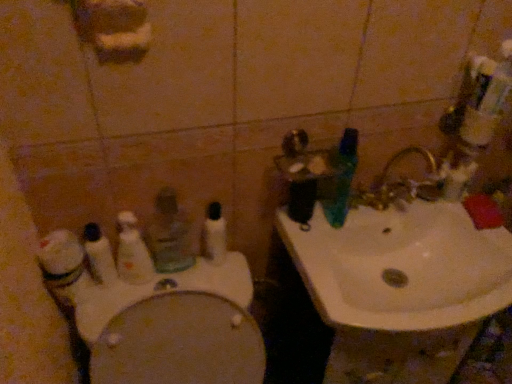
Question: Can you confirm if white plastic toothbrush at left, which appears as the fourth toothbrush when viewed from the right, is bigger than white glossy toilet at lower left?

Choices:
 (A) yes
 (B) no

Answer: (B)

Question: Is the position of white plastic toothbrush at left, which is the first toothbrush in left-to-right order, more distant than that of white glossy toilet at lower left?

Choices:
 (A) yes
 (B) no

Answer: (A)

Question: From a real-world perspective, is white plastic toothbrush at left, which appears as the fourth toothbrush when viewed from the right, below white glossy toilet at lower left?

Choices:
 (A) yes
 (B) no

Answer: (B)

Question: From the image's perspective, is white plastic toothbrush at left, which appears as the fourth toothbrush when viewed from the right, under white glossy toilet at lower left?

Choices:
 (A) yes
 (B) no

Answer: (B)

Question: Does white plastic toothbrush at left, which appears as the fourth toothbrush when viewed from the right, have a greater height compared to white glossy toilet at lower left?

Choices:
 (A) yes
 (B) no

Answer: (B)

Question: In the image, is white matte cleaning product at left on the left side or the right side of white glossy toilet at lower left?

Choices:
 (A) left
 (B) right

Answer: (A)

Question: Is white matte cleaning product at left inside the boundaries of white glossy toilet at lower left, or outside?

Choices:
 (A) inside
 (B) outside

Answer: (B)

Question: Looking at their shapes, would you say white matte cleaning product at left is wider or thinner than white glossy toilet at lower left?

Choices:
 (A) thin
 (B) wide

Answer: (A)

Question: Is point (73, 241) positioned closer to the camera than point (96, 342)?

Choices:
 (A) closer
 (B) farther

Answer: (B)

Question: Considering the positions of green plastic toothbrush at upper right, which ranks as the 4th toothbrush in left-to-right order, and white matte cleaning product at left in the image, is green plastic toothbrush at upper right, which ranks as the 4th toothbrush in left-to-right order, taller or shorter than white matte cleaning product at left?

Choices:
 (A) tall
 (B) short

Answer: (A)

Question: Looking at their shapes, would you say green plastic toothbrush at upper right, which ranks as the 4th toothbrush in left-to-right order, is wider or thinner than white matte cleaning product at left?

Choices:
 (A) wide
 (B) thin

Answer: (A)

Question: Is point (339, 140) positioned closer to the camera than point (64, 279)?

Choices:
 (A) farther
 (B) closer

Answer: (A)

Question: Is green plastic toothbrush at upper right, the 1th toothbrush when ordered from right to left, to the left or to the right of white matte cleaning product at left in the image?

Choices:
 (A) left
 (B) right

Answer: (B)

Question: Looking at the image, does white matte cleaning product at left seem bigger or smaller compared to white plastic toothbrush at center, which is the third toothbrush from left to right?

Choices:
 (A) small
 (B) big

Answer: (B)

Question: Is white matte cleaning product at left wider or thinner than white plastic toothbrush at center, which is the third toothbrush from left to right?

Choices:
 (A) wide
 (B) thin

Answer: (A)